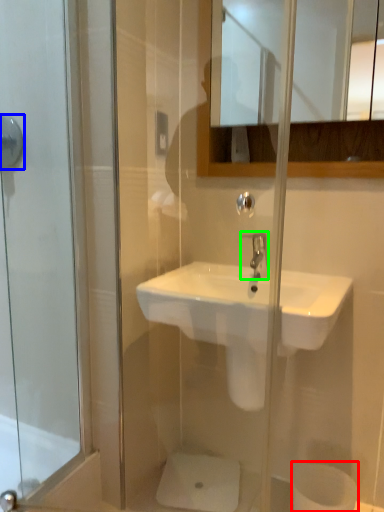
Question: Which object is the closest to the toilet paper (highlighted by a red box)? Choose among these: shower (highlighted by a blue box) or tap (highlighted by a green box).

Choices:
 (A) shower
 (B) tap

Answer: (B)